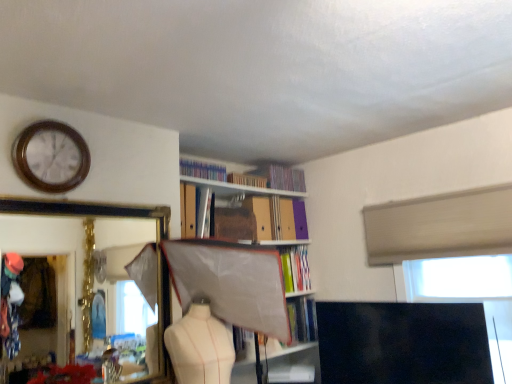
Question: Is hardcover book at center, the 7th book from the top, thinner than white plastic window screen at upper right?

Choices:
 (A) no
 (B) yes

Answer: (A)

Question: From a real-world perspective, is hardcover book at center, the 2th book ordered from the bottom, under white plastic window screen at upper right?

Choices:
 (A) yes
 (B) no

Answer: (A)

Question: Are hardcover book at center, the 2th book ordered from the bottom, and white plastic window screen at upper right far apart?

Choices:
 (A) no
 (B) yes

Answer: (A)

Question: Considering the relative sizes of hardcover book at center, the 7th book from the top, and white plastic window screen at upper right in the image provided, is hardcover book at center, the 7th book from the top, smaller than white plastic window screen at upper right?

Choices:
 (A) yes
 (B) no

Answer: (A)

Question: Does hardcover book at center, the 2th book ordered from the bottom, touch white plastic window screen at upper right?

Choices:
 (A) yes
 (B) no

Answer: (B)

Question: From a real-world perspective, is hardcover book at center, the 7th book from the top, positioned over white plastic window screen at upper right based on gravity?

Choices:
 (A) no
 (B) yes

Answer: (A)

Question: Is matte cardboard book at upper center, positioned as the 4th book in top-to-bottom order, in contact with white plastic window screen at upper right?

Choices:
 (A) yes
 (B) no

Answer: (B)

Question: From the image's perspective, is matte cardboard book at upper center, the fifth book in the bottom-to-top sequence, over white plastic window screen at upper right?

Choices:
 (A) yes
 (B) no

Answer: (A)

Question: Would you consider matte cardboard book at upper center, the fifth book in the bottom-to-top sequence, to be distant from white plastic window screen at upper right?

Choices:
 (A) no
 (B) yes

Answer: (B)

Question: Considering the relative sizes of matte cardboard book at upper center, positioned as the 4th book in top-to-bottom order, and white plastic window screen at upper right in the image provided, is matte cardboard book at upper center, positioned as the 4th book in top-to-bottom order, bigger than white plastic window screen at upper right?

Choices:
 (A) yes
 (B) no

Answer: (B)

Question: Can you confirm if matte cardboard book at upper center, the fifth book in the bottom-to-top sequence, is wider than white plastic window screen at upper right?

Choices:
 (A) yes
 (B) no

Answer: (B)

Question: Can white plastic window screen at upper right be found inside matte cardboard book at upper center, positioned as the 4th book in top-to-bottom order?

Choices:
 (A) yes
 (B) no

Answer: (B)

Question: From a real-world perspective, is white plastic window screen at upper right below metallic silver book at upper center, acting as the 5th book starting from the top?

Choices:
 (A) yes
 (B) no

Answer: (A)